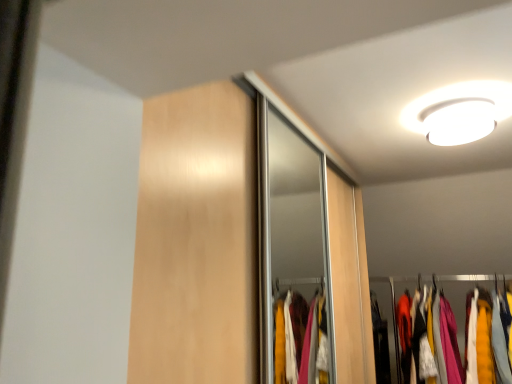
Question: Should I look upward or downward to see white glossy light fixture at upper right?

Choices:
 (A) down
 (B) up

Answer: (B)